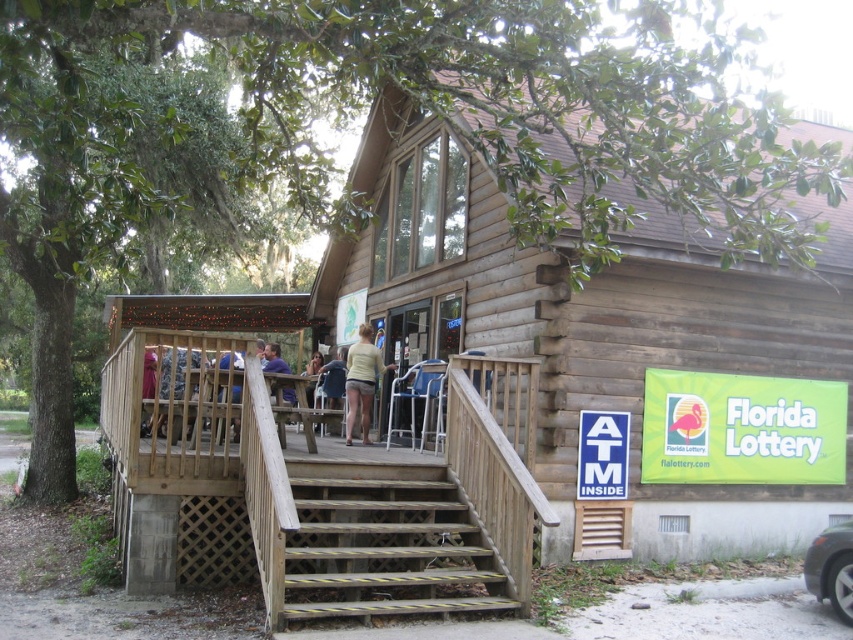
You are a customer at the rustic wooden building and want to choose between the light yellow fabric shorts at center and the dark blue jeans at left. Which of these two items has a narrower width?

The light yellow fabric shorts at center has a lesser width compared to the dark blue jeans at left.

You are standing at the entrance of the rustic wooden building and want to take a photo of two specific points marked in the scene. The first point is labeled as point (352, 371) and the second is point (192, 422). Which point should you focus on first if you want to capture both points clearly in a single photo without moving the camera?

You should focus on point (352, 371) first because it is closer to the camera than point (192, 422). Since it is further away from the camera, focusing on the closer point ensures both points will be in focus when using a standard camera focusing technique.